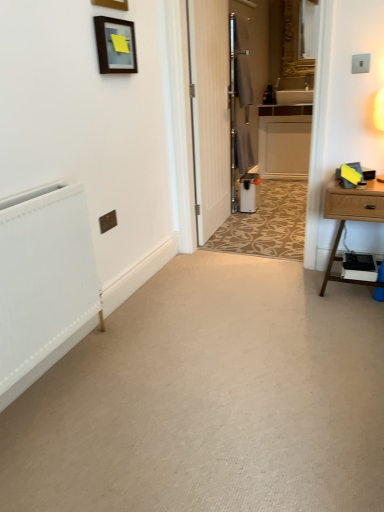
Question: In which direction should I rotate to look at matte wooden picture frame at upper center, placed as the second picture frame when sorted from bottom to top?

Choices:
 (A) right
 (B) left

Answer: (B)

Question: Is white plastic air purifier at center turned away from white textured radiator at left?

Choices:
 (A) yes
 (B) no

Answer: (B)

Question: Is the depth of white plastic air purifier at center less than that of white textured radiator at left?

Choices:
 (A) no
 (B) yes

Answer: (A)

Question: Is white plastic air purifier at center positioned beyond the bounds of white textured radiator at left?

Choices:
 (A) no
 (B) yes

Answer: (B)

Question: From a real-world perspective, does white plastic air purifier at center sit lower than white textured radiator at left?

Choices:
 (A) no
 (B) yes

Answer: (B)

Question: Is white plastic air purifier at center wider than white textured radiator at left?

Choices:
 (A) yes
 (B) no

Answer: (A)

Question: Could you tell me if white plastic air purifier at center is facing white textured radiator at left?

Choices:
 (A) yes
 (B) no

Answer: (B)

Question: From the image's perspective, would you say matte black picture frame at upper left, the 1th picture frame from the bottom, is shown under light brown wood nightstand at right?

Choices:
 (A) yes
 (B) no

Answer: (B)

Question: Does matte black picture frame at upper left, which ranks as the 2th picture frame in top-to-bottom order, have a lesser width compared to light brown wood nightstand at right?

Choices:
 (A) yes
 (B) no

Answer: (A)

Question: Is light brown wood nightstand at right inside matte black picture frame at upper left, the 1th picture frame from the bottom?

Choices:
 (A) no
 (B) yes

Answer: (A)

Question: From a real-world perspective, is matte black picture frame at upper left, which ranks as the 2th picture frame in top-to-bottom order, physically above light brown wood nightstand at right?

Choices:
 (A) no
 (B) yes

Answer: (B)

Question: From the image's perspective, is matte black picture frame at upper left, the 1th picture frame from the bottom, over light brown wood nightstand at right?

Choices:
 (A) no
 (B) yes

Answer: (B)

Question: Is matte black picture frame at upper left, which ranks as the 2th picture frame in top-to-bottom order, facing towards light brown wood nightstand at right?

Choices:
 (A) yes
 (B) no

Answer: (B)

Question: Is the depth of matte black picture frame at upper left, the 1th picture frame from the bottom, greater than that of gold ornate mirror at upper center?

Choices:
 (A) yes
 (B) no

Answer: (B)